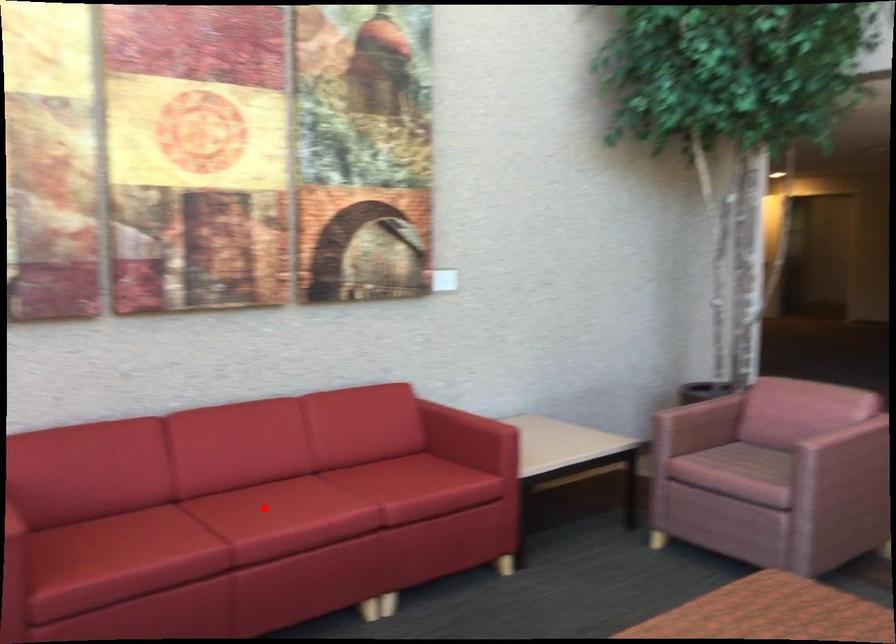
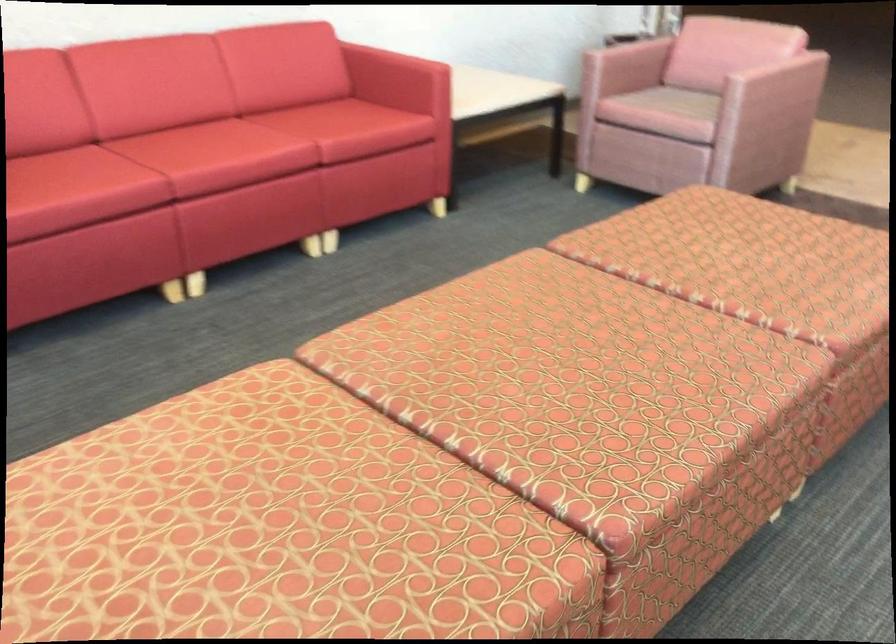
Locate, in the second image, the point that corresponds to the highlighted location in the first image.

(196, 144)